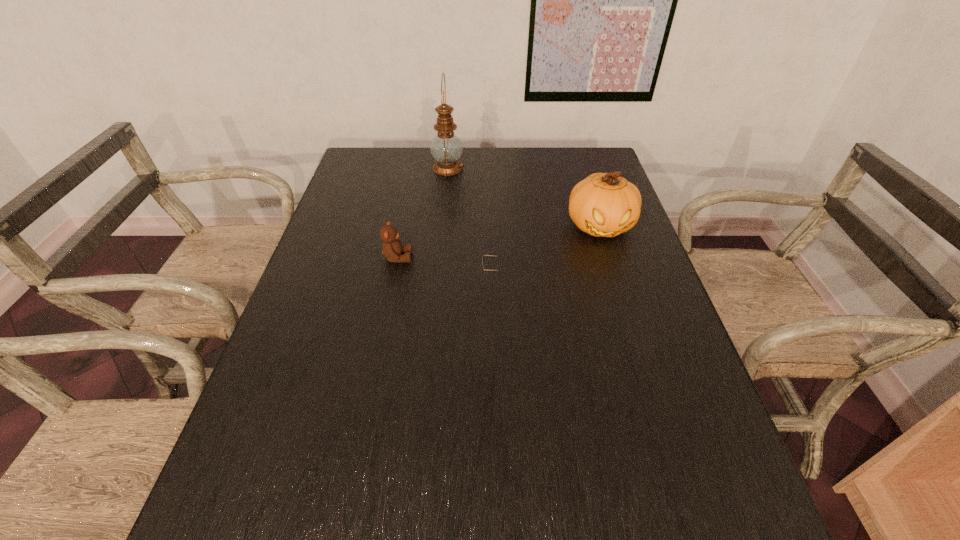
Select which object is the closest to the third object from right to left. Please provide its 2D coordinates. Your answer should be formatted as a tuple, i.e. [(x, y)], where the tuple contains the x and y coordinates of a point satisfying the conditions above.

[(604, 205)]

Locate an element on the screen. free point that satisfies the following two spatial constraints: 1. on the front face of the second farthest object; 2. on the face of the teddy bear is located at coordinates (611, 258).

Locate an element on the screen. The image size is (960, 540). vacant position in the image that satisfies the following two spatial constraints: 1. on the front face of the second tallest object; 2. in front of the lenses of the third object from left to right is located at coordinates (616, 277).